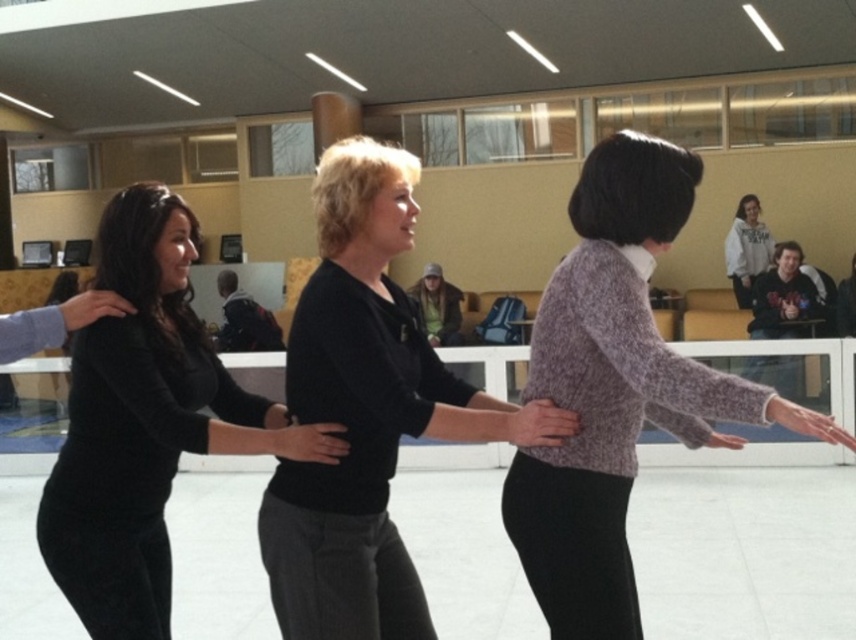
You are a photographer positioned at the entrance of the ice rink. You want to take a photo of the black matte sweater at center and the white fleece sweatshirt at upper right without any obstruction. Based on their positions, which one should you focus on first to ensure both are visible in the frame?

The black matte sweater at center is in front of the white fleece sweatshirt at upper right, so you should focus on the white fleece sweatshirt at upper right first to ensure both are visible without obstruction.

You are a photographer standing at the entrance of the ice rink. You want to capture a photo of the black ribbed sweater at center and the other two women in the group. Since you want all three women to be in the frame, will you need to adjust your camera angle to include everyone?

The three women are 7.34 feet apart, so adjusting the camera angle slightly should allow you to include all three in the frame since 7.34 feet is a reasonable distance for a group photo in an ice rink setting.

You are an observer standing at the entrance of the ice rink. You notice two people wearing the knitted purple sweater at center and the white fleece sweatshirt at upper right. Based on their clothing, which person is taller?

The knitted purple sweater at center is taller than the white fleece sweatshirt at upper right, so the person wearing the knitted purple sweater at center is taller.